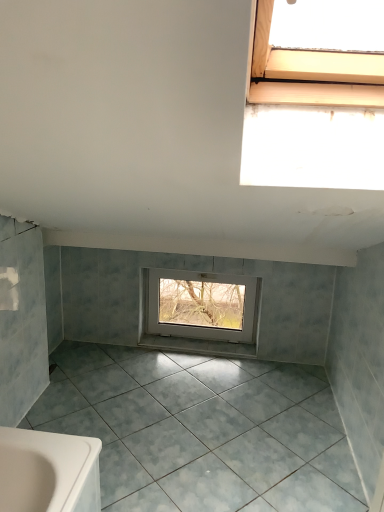
Locate an element on the screen. This screenshot has height=512, width=384. free location above gray matte tile at center (from a real-world perspective) is located at coordinates (187, 422).